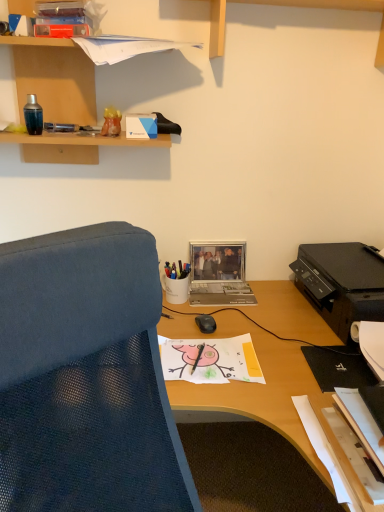
Image resolution: width=384 pixels, height=512 pixels. Find the location of `vacant space that is to the left of black matte pen at center, marked as the 1th pen in a front-to-back arrangement`. vacant space that is to the left of black matte pen at center, marked as the 1th pen in a front-to-back arrangement is located at coordinates (170, 357).